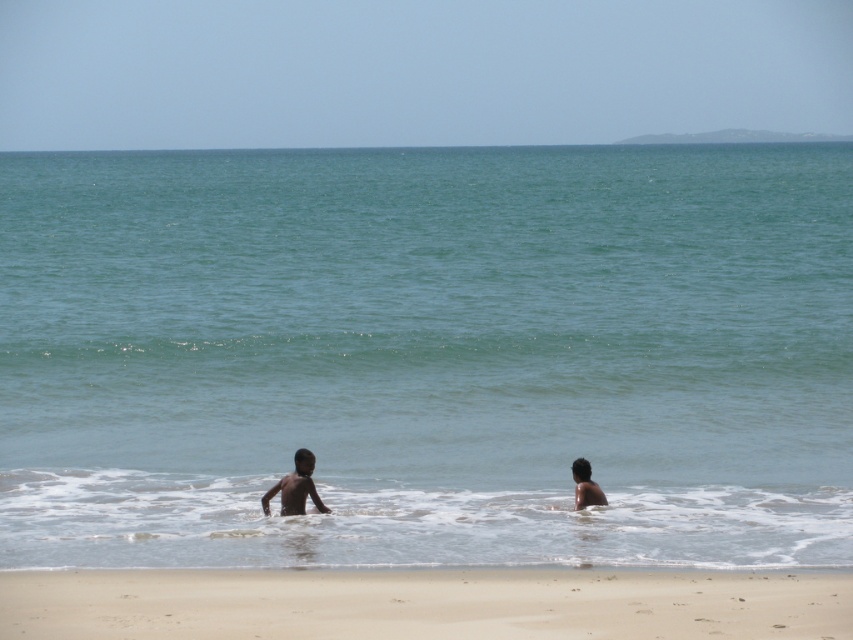
Question: Which point is closer to the camera?

Choices:
 (A) (299, 461)
 (B) (733, 600)
 (C) (592, 496)

Answer: (B)

Question: Is brown skin child at center above dark skin child at lower right?

Choices:
 (A) yes
 (B) no

Answer: (A)

Question: Does clear blue water at center appear over dark skin child at lower right?

Choices:
 (A) yes
 (B) no

Answer: (A)

Question: Among these objects, which one is nearest to the camera?

Choices:
 (A) sandy beach at lower center
 (B) dark skin child at lower right

Answer: (A)

Question: Is brown skin child at center above dark skin child at lower right?

Choices:
 (A) no
 (B) yes

Answer: (B)

Question: Among these points, which one is nearest to the camera?

Choices:
 (A) (576, 490)
 (B) (201, 618)

Answer: (B)